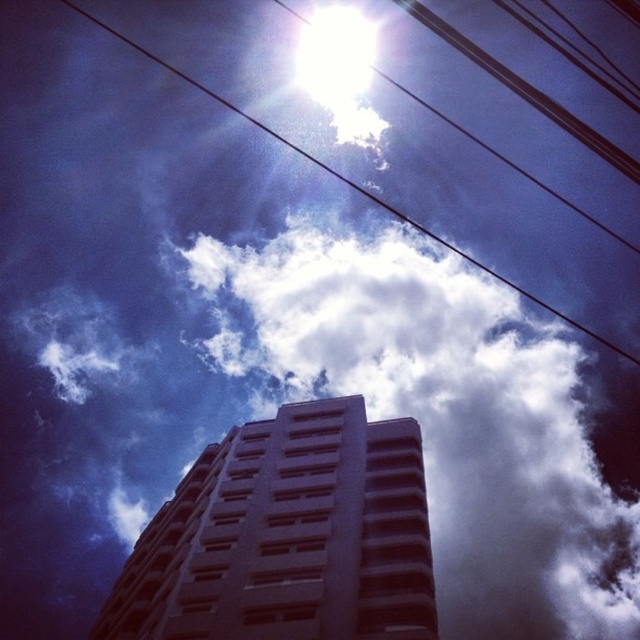
Question: Can you confirm if smooth concrete building at center is thinner than metallic wire at upper center?

Choices:
 (A) yes
 (B) no

Answer: (A)

Question: Does white fluffy cloud at upper center lie behind smooth concrete building at center?

Choices:
 (A) yes
 (B) no

Answer: (A)

Question: Which point is farther from the camera taking this photo?

Choices:
 (A) (333, 417)
 (B) (332, 353)

Answer: (B)

Question: Can you confirm if white fluffy cloud at upper center is thinner than smooth concrete building at center?

Choices:
 (A) no
 (B) yes

Answer: (A)

Question: Which object is the closest to the smooth concrete building at center?

Choices:
 (A) white fluffy cloud at upper center
 (B) metallic wire at upper center

Answer: (B)

Question: Which point is farther to the camera?

Choices:
 (A) (524, 385)
 (B) (296, 593)
 (C) (488, 273)

Answer: (C)